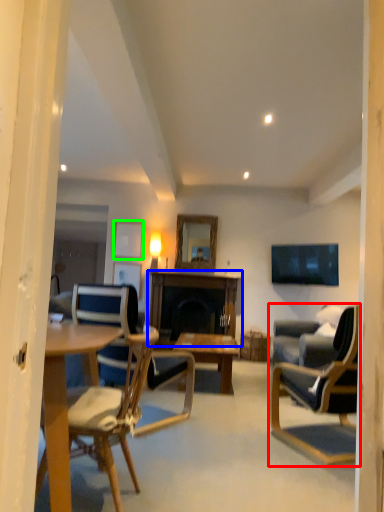
Question: Based on their relative distances, which object is farther from chair (highlighted by a red box)? Choose from table (highlighted by a blue box) and picture frame (highlighted by a green box).

Choices:
 (A) table
 (B) picture frame

Answer: (B)